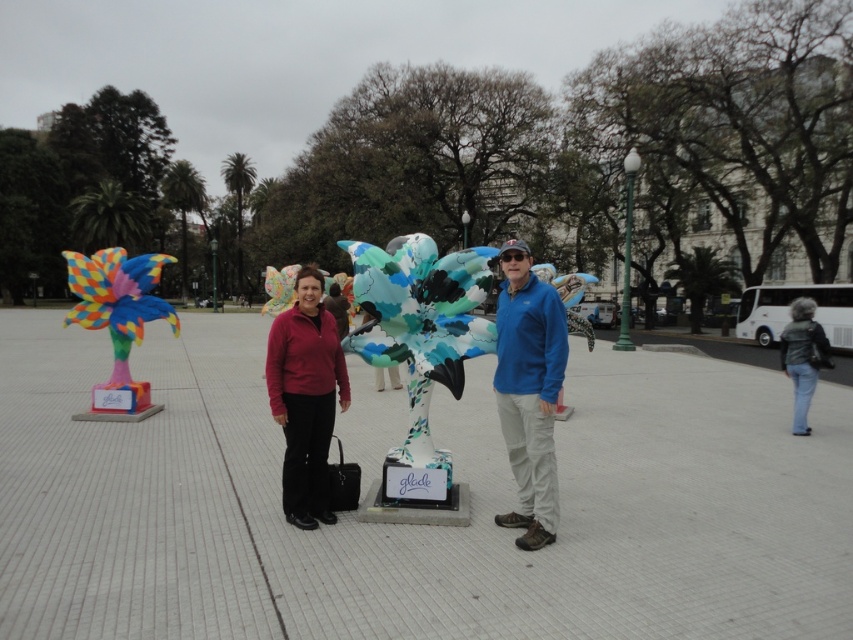
Question: Which point is closer to the camera taking this photo?

Choices:
 (A) (817, 358)
 (B) (770, 484)
 (C) (320, 410)
 (D) (553, 461)

Answer: (D)

Question: Does white tile pavement at center have a smaller size compared to matte red sweater at center?

Choices:
 (A) no
 (B) yes

Answer: (A)

Question: Which point is closer to the camera?

Choices:
 (A) (230, 586)
 (B) (323, 326)
 (C) (445, 348)
 (D) (506, 316)

Answer: (A)

Question: From the image, what is the correct spatial relationship of blue fleece jacket at center in relation to multicolored painted bird at left?

Choices:
 (A) right
 (B) left

Answer: (A)

Question: Which object is farther from the camera taking this photo?

Choices:
 (A) multicolored painted bird at left
 (B) matte multicolored sculpture at center

Answer: (A)

Question: Can you confirm if matte multicolored sculpture at center is positioned to the left of multicolored painted bird at left?

Choices:
 (A) no
 (B) yes

Answer: (A)